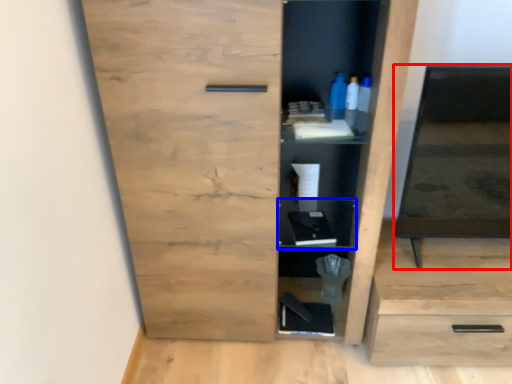
Question: Among these objects, which one is nearest to the camera, medicine cabinet (highlighted by a red box) or cabinet (highlighted by a blue box)?

Choices:
 (A) medicine cabinet
 (B) cabinet

Answer: (A)